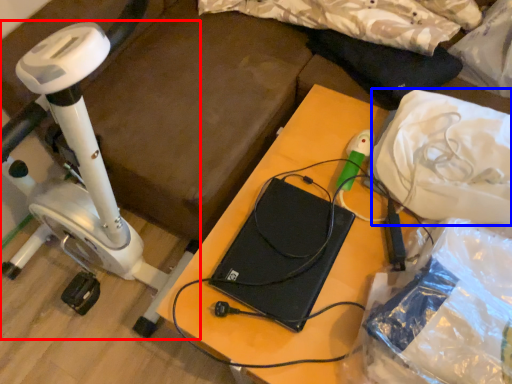
Question: Among these objects, which one is nearest to the camera, stationary bicycle (highlighted by a red box) or material (highlighted by a blue box)?

Choices:
 (A) stationary bicycle
 (B) material

Answer: (A)